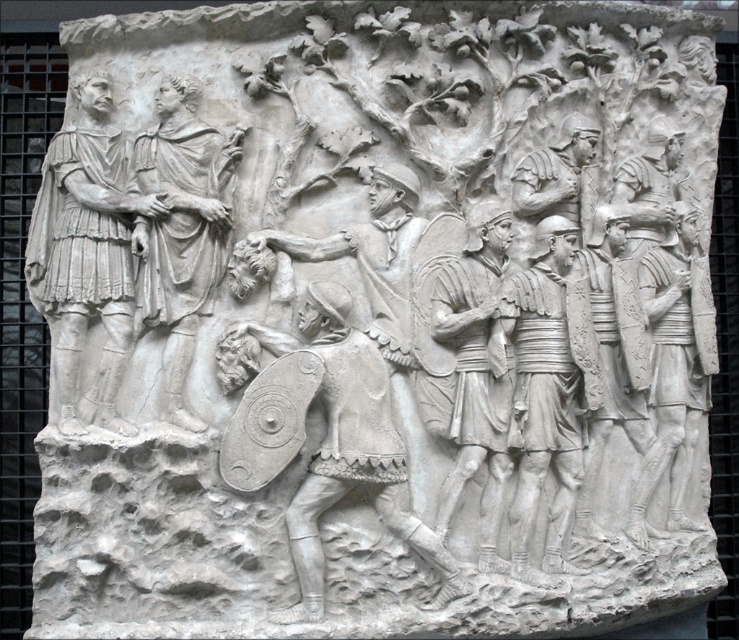
You are an art conservator examining the Roman relief sculpture. You notice two points on the sculpture, one at coordinate point (98, 314) and another at point (174, 161). Which point is positioned closer to the viewer?

Point (98, 314) is closer to the camera than point (174, 161), so the point at (98, 314) is positioned closer to the viewer.

Based on the Roman relief sculpture described, which object is shorter between the white stone figure at left and the white stone soldiers at center?

The white stone figure at left is shorter than the white stone soldiers at center.